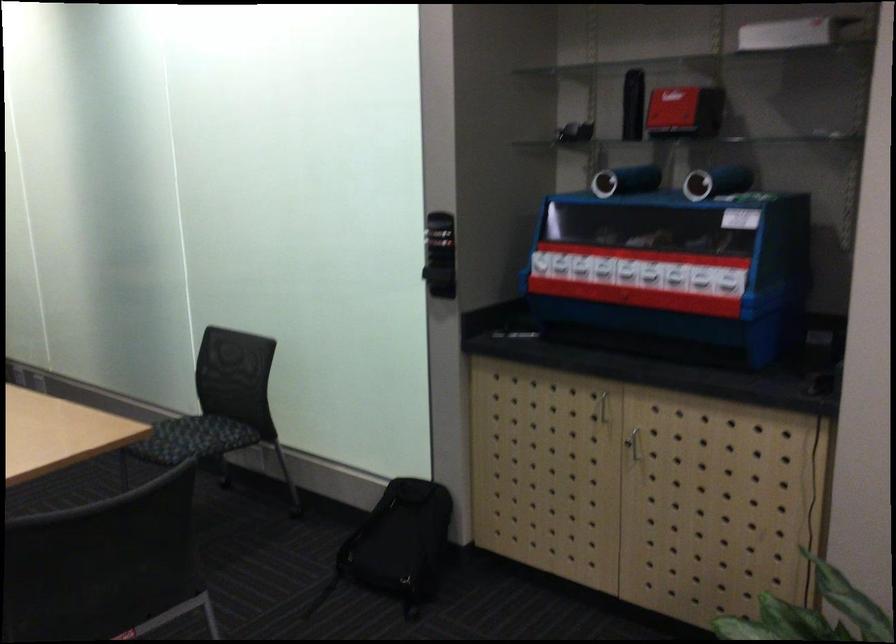
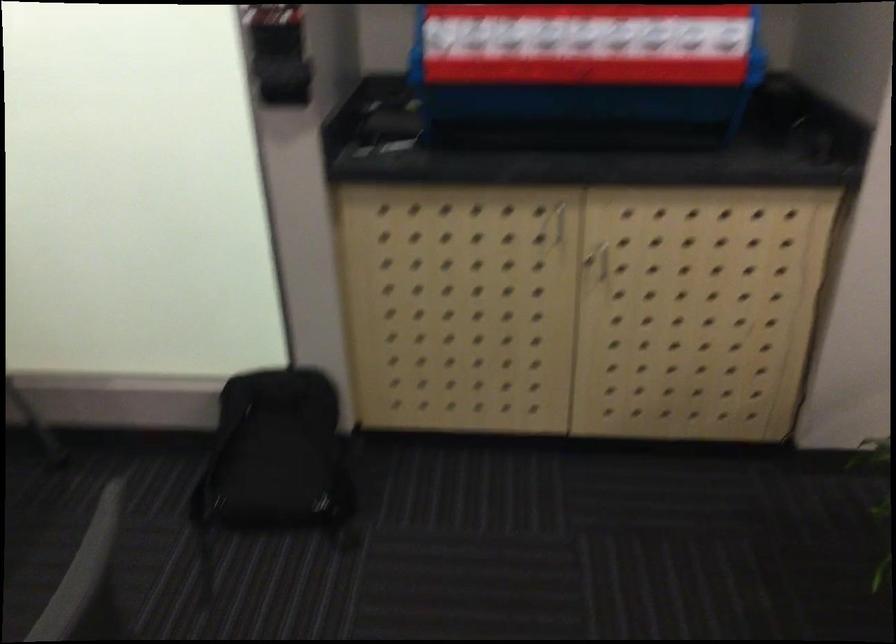
Locate, in the second image, the point that corresponds to [609,406] in the first image.

(558, 223)